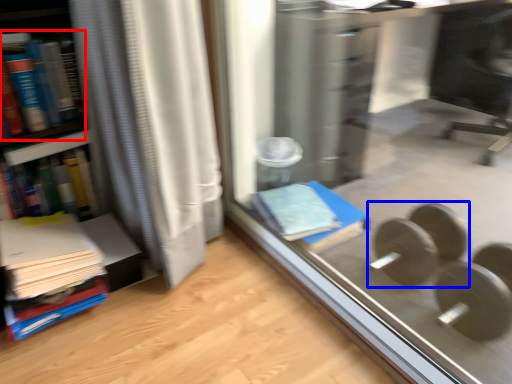
Question: Which point is closer to the camera, book (highlighted by a red box) or dumbbell (highlighted by a blue box)?

Choices:
 (A) book
 (B) dumbbell

Answer: (A)